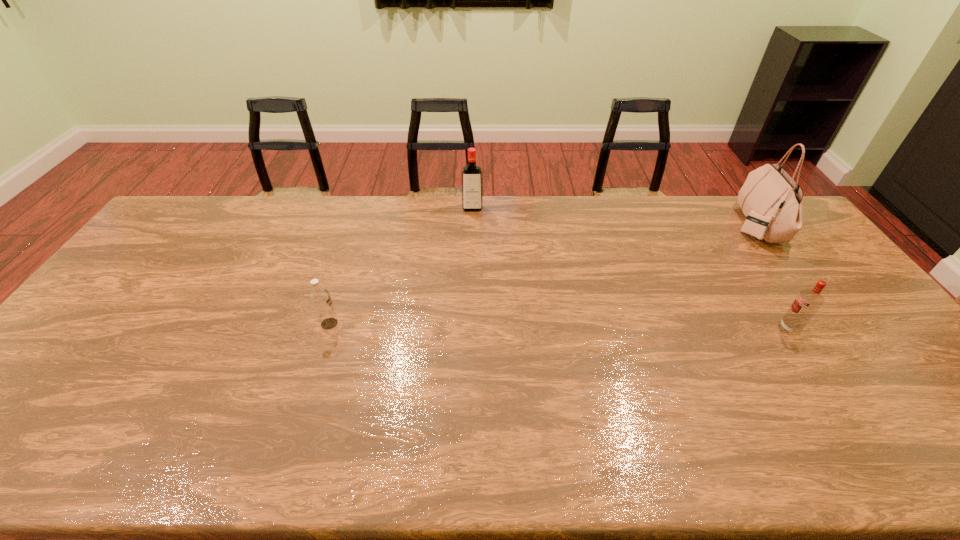
Find the location of `vacant space at the left edge of the desktop`. vacant space at the left edge of the desktop is located at coordinates (118, 315).

Find the location of `free region at the right edge`. free region at the right edge is located at coordinates coord(831,292).

What are the coordinates of `free space that is in between the rightmost object and the rightmost vodka` in the screenshot? It's located at (772, 276).

Locate an element on the screen. The width and height of the screenshot is (960, 540). free space between the leftmost object and the third object from right to left is located at coordinates (401, 266).

This screenshot has height=540, width=960. I want to click on free space that is in between the leftmost vodka and the handbag, so click(542, 274).

Locate an element on the screen. The image size is (960, 540). empty space between the leftmost object and the third object from left to right is located at coordinates (559, 326).

Find the location of a particular element. vacant space that's between the rightmost vodka and the handbag is located at coordinates (772, 276).

At what (x,y) coordinates should I click in order to perform the action: click on empty space between the third object from left to right and the second vodka from left to right. Please return your answer as a coordinate pair (x, y). The height and width of the screenshot is (540, 960). Looking at the image, I should click on (631, 269).

The height and width of the screenshot is (540, 960). I want to click on empty space between the tallest object and the second vodka from right to left, so click(613, 217).

This screenshot has width=960, height=540. Find the location of `vacant space in between the tallest vodka and the rightmost object`. vacant space in between the tallest vodka and the rightmost object is located at coordinates (613, 217).